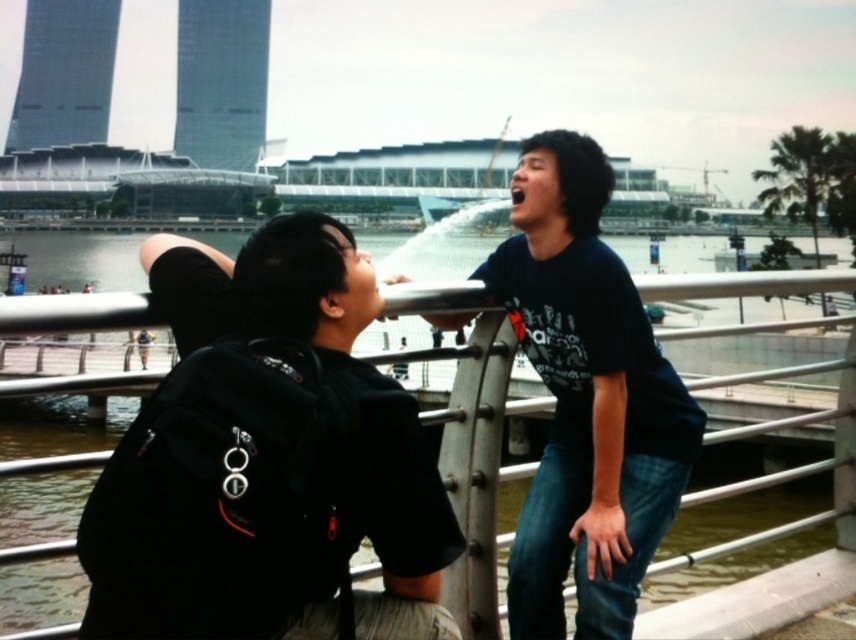
You are a delivery drone trying to deliver a package to the black matte backpack at center. The drone can only fly horizontally and must avoid obstacles. Given that the backpack is at coordinates point 0.719, 0.313, what is the safest horizontal direction to fly to reach it?

The safest horizontal direction to fly to reach the black matte backpack at center would be directly towards its coordinates point (x=266, y=460), assuming no obstacles are present in that path as per the scene description.

Consider the image. You are standing on the bridge and want to walk to both the point at coordinates (242, 472) and the point at coordinates (631, 582). Which point will you reach first if you start walking towards them?

You will reach the point at coordinates (242, 472) first because it is closer to you than the point at coordinates (631, 582).